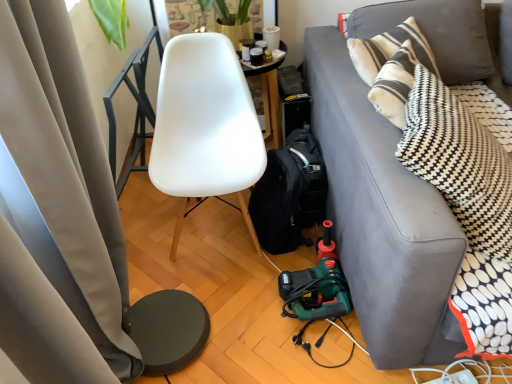
You are a GUI agent. You are given a task and a screenshot of the screen. Output one action in this format:
    pyautogui.click(x=<x>, y=<y>)
    Task: Click on the vacant space behind matte gray curtain at left
    This screenshot has height=384, width=512.
    Given the screenshot: What is the action you would take?
    pyautogui.click(x=175, y=270)